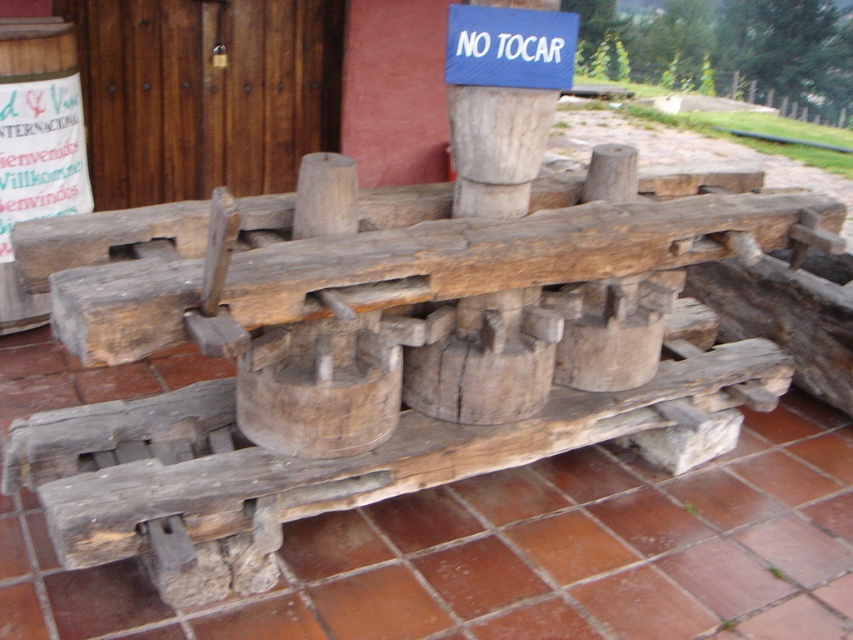
Question: Can you confirm if wooden post at center is wider than blue fabric sign at upper center?

Choices:
 (A) yes
 (B) no

Answer: (B)

Question: Among these points, which one is nearest to the camera?

Choices:
 (A) (454, 40)
 (B) (502, 168)

Answer: (A)

Question: Does wooden post at center have a larger size compared to blue fabric sign at upper center?

Choices:
 (A) no
 (B) yes

Answer: (B)

Question: Which of the following is the farthest from the observer?

Choices:
 (A) wooden post at center
 (B) blue fabric sign at upper center

Answer: (A)

Question: Does wooden post at center appear under blue fabric sign at upper center?

Choices:
 (A) no
 (B) yes

Answer: (B)